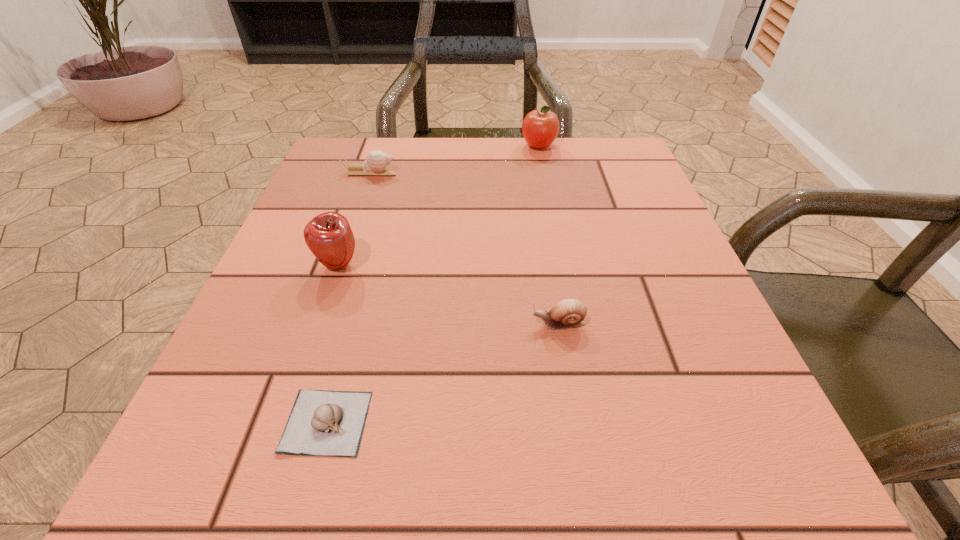
Identify the location of apple situated at the left edge. (329, 236).

The width and height of the screenshot is (960, 540). I want to click on escargot at the left edge, so click(x=376, y=162).

Locate an element on the screen. The image size is (960, 540). garlic situated at the left edge is located at coordinates (328, 423).

Locate an element on the screen. object located at the far left corner is located at coordinates (376, 162).

You are a GUI agent. You are given a task and a screenshot of the screen. Output one action in this format:
    pyautogui.click(x=<x>, y=<y>)
    Task: Click on the object at the near left corner
    
    Given the screenshot: What is the action you would take?
    pyautogui.click(x=328, y=423)

Image resolution: width=960 pixels, height=540 pixels. In order to click on vacant area at the far edge in this screenshot , I will do 452,151.

At what (x,y) coordinates should I click in order to perform the action: click on blank space at the near edge of the desktop. Please return your answer as a coordinate pair (x, y). Looking at the image, I should click on (483, 446).

In the image, there is a desktop. What are the coordinates of `vacant space at the left edge` in the screenshot? It's located at (269, 379).

At what (x,y) coordinates should I click in order to perform the action: click on free location at the right edge. Please return your answer as a coordinate pair (x, y). This screenshot has height=540, width=960. Looking at the image, I should click on (588, 235).

Where is `vacant space at the far left corner of the desktop`? The width and height of the screenshot is (960, 540). vacant space at the far left corner of the desktop is located at coordinates (343, 185).